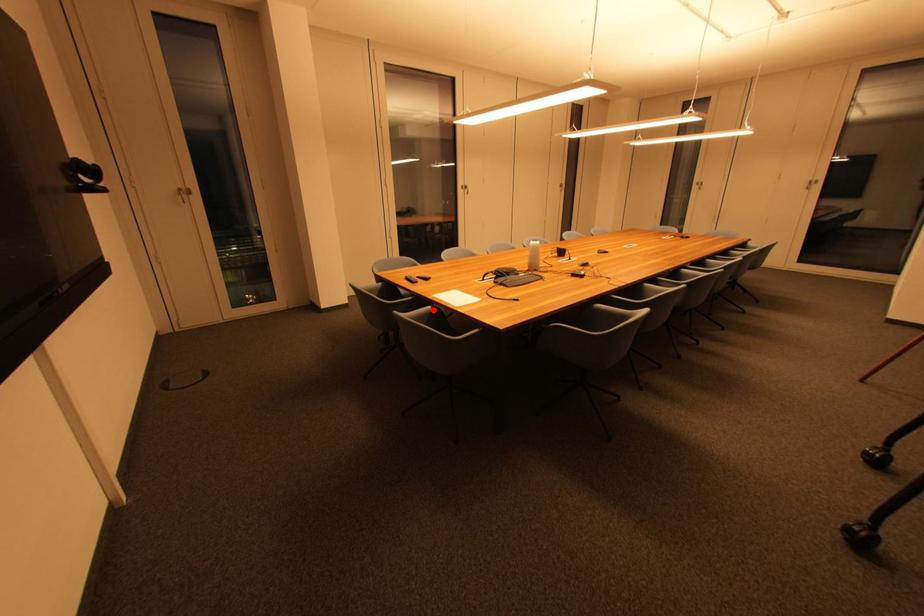
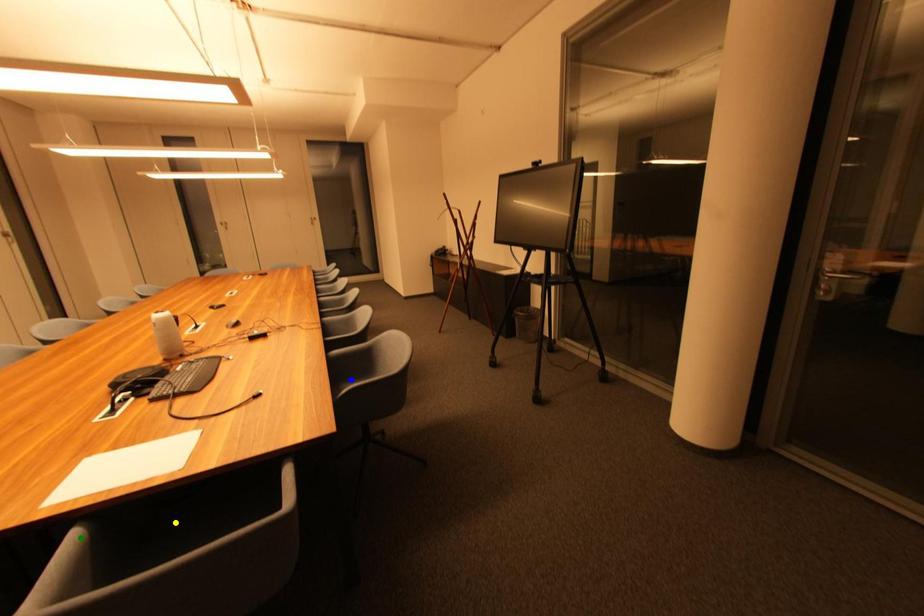
Question: I am providing you with two images of the same scene from different viewpoints. A red point is marked on the first image. You are given multiple points on the second image. Can you choose the point in image 2 that corresponds to the point in image 1?

Choices:
 (A) green point
 (B) blue point
 (C) yellow point

Answer: (A)